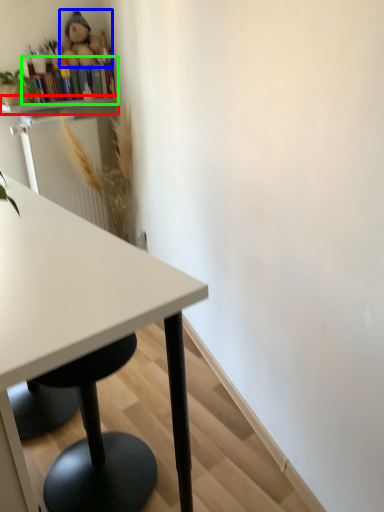
Question: Based on their relative distances, which object is farther from shelf (highlighted by a red box)? Choose from toy (highlighted by a blue box) and bookshelf (highlighted by a green box).

Choices:
 (A) toy
 (B) bookshelf

Answer: (A)